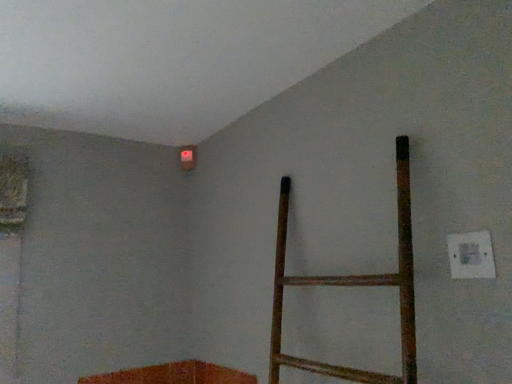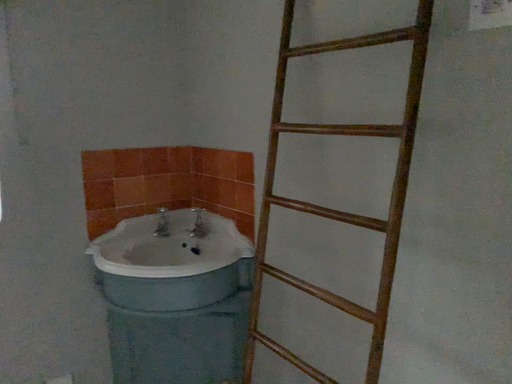
Question: How did the camera likely rotate when shooting the video?

Choices:
 (A) rotated downward
 (B) rotated upward

Answer: (A)